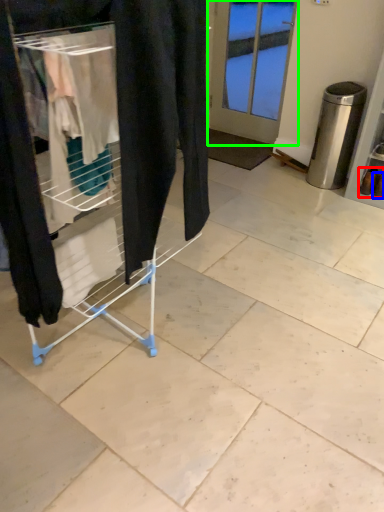
Question: Which object is positioned farthest from footwear (highlighted by a red box)? Select from footwear (highlighted by a blue box) and door (highlighted by a green box).

Choices:
 (A) footwear
 (B) door

Answer: (B)